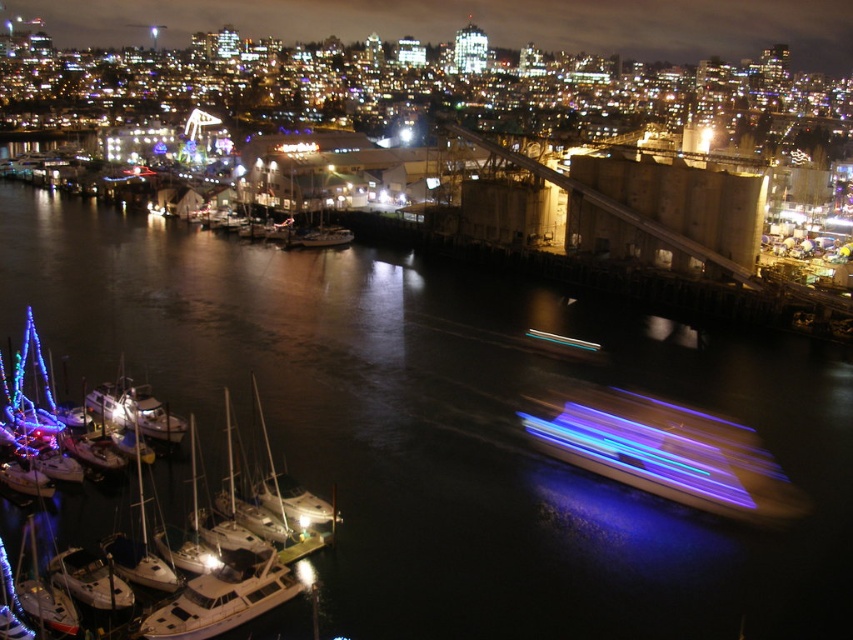
Does blue light trails at center appear on the right side of white matte sailboat at center?

Correct, you'll find blue light trails at center to the right of white matte sailboat at center.

Image resolution: width=853 pixels, height=640 pixels. Find the location of `blue light trails at center`. blue light trails at center is located at coordinates pos(666,452).

Locate an element on the screen. This screenshot has height=640, width=853. blue light trails at center is located at coordinates (666, 452).

Does white matte sailboats at lower left lie in front of metallic blue boat at center?

Yes, it is.

I want to click on white matte sailboats at lower left, so click(x=212, y=584).

Which of these two, white matte sailboats at lower left or white matte sailboat at center, stands shorter?

white matte sailboat at center is shorter.

Measure the distance between white matte sailboats at lower left and camera.

34.74 meters

In order to click on white matte sailboats at lower left in this screenshot , I will do `click(212, 584)`.